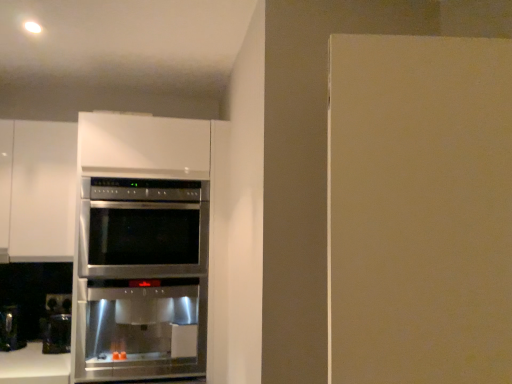
Question: From their relative heights in the image, would you say black glossy coffee machine at lower left is taller or shorter than stainless steel oven at center?

Choices:
 (A) tall
 (B) short

Answer: (B)

Question: Considering the relative positions of black glossy coffee machine at lower left and stainless steel oven at center in the image provided, is black glossy coffee machine at lower left to the left or to the right of stainless steel oven at center?

Choices:
 (A) left
 (B) right

Answer: (A)

Question: Considering the positions of black glossy coffee machine at lower left and stainless steel oven at center in the image, is black glossy coffee machine at lower left bigger or smaller than stainless steel oven at center?

Choices:
 (A) small
 (B) big

Answer: (A)

Question: In terms of width, does stainless steel oven at center look wider or thinner when compared to black glossy coffee machine at lower left?

Choices:
 (A) thin
 (B) wide

Answer: (B)

Question: Is stainless steel oven at center in front of or behind black glossy coffee machine at lower left in the image?

Choices:
 (A) front
 (B) behind

Answer: (A)

Question: Is stainless steel oven at center situated inside black glossy coffee machine at lower left or outside?

Choices:
 (A) outside
 (B) inside

Answer: (A)

Question: From the image's perspective, relative to black glossy coffee machine at lower left, is stainless steel oven at center above or below?

Choices:
 (A) above
 (B) below

Answer: (A)